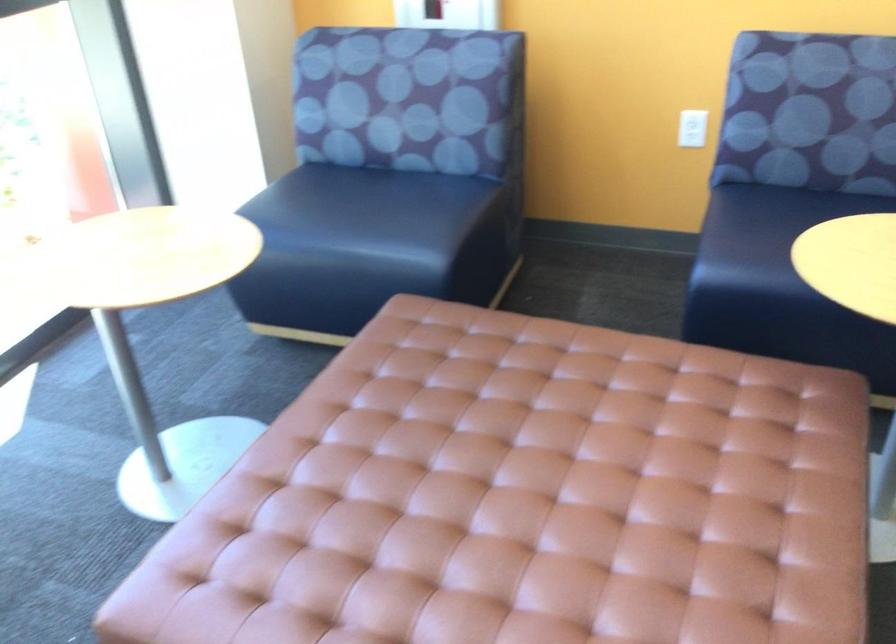
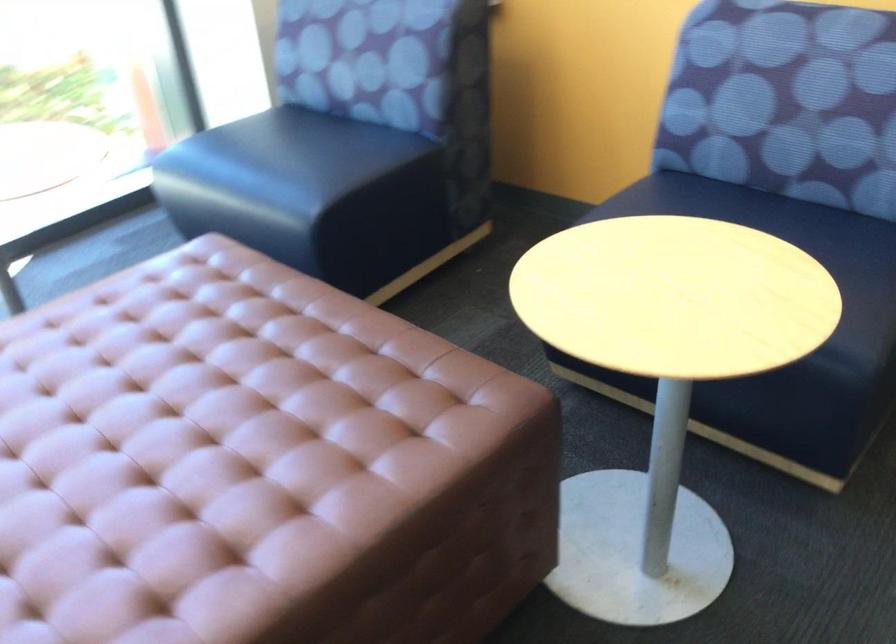
Question: The images are taken continuously from a first-person perspective. In which direction are you moving?

Choices:
 (A) Left
 (B) Right
 (C) Forward
 (D) Backward

Answer: (B)